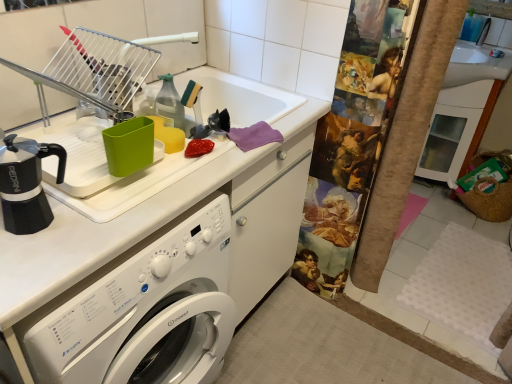
Question: Considering the positions of black matte coffee pot at left and brushed metal faucet at upper center in the image, is black matte coffee pot at left taller or shorter than brushed metal faucet at upper center?

Choices:
 (A) tall
 (B) short

Answer: (A)

Question: In terms of width, does black matte coffee pot at left look wider or thinner when compared to brushed metal faucet at upper center?

Choices:
 (A) thin
 (B) wide

Answer: (B)

Question: Which object is the farthest from the brushed metal faucet at upper center?

Choices:
 (A) white glossy washing machine at center
 (B) metallic silver dish rack at upper left
 (C) black matte coffee pot at left

Answer: (C)

Question: Which object is positioned closest to the black matte coffee pot at left?

Choices:
 (A) brushed metal faucet at upper center
 (B) metallic silver dish rack at upper left
 (C) white glossy washing machine at center

Answer: (B)